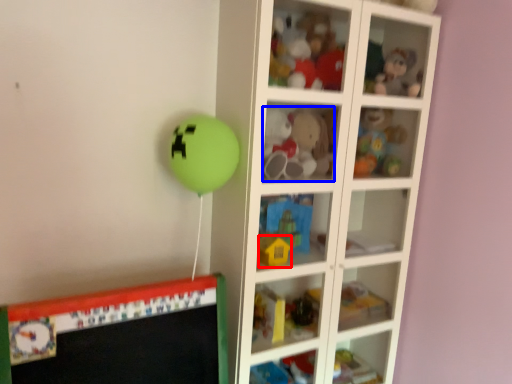
Question: Among these objects, which one is nearest to the camera, toy (highlighted by a red box) or toy (highlighted by a blue box)?

Choices:
 (A) toy
 (B) toy

Answer: (A)